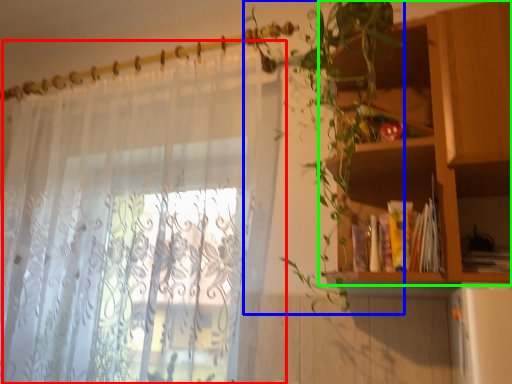
Question: Estimate the real-world distances between objects in this image. Which object is farther from curtain (highlighted by a red box), vegetation (highlighted by a blue box) or shelf (highlighted by a green box)?

Choices:
 (A) vegetation
 (B) shelf

Answer: (B)